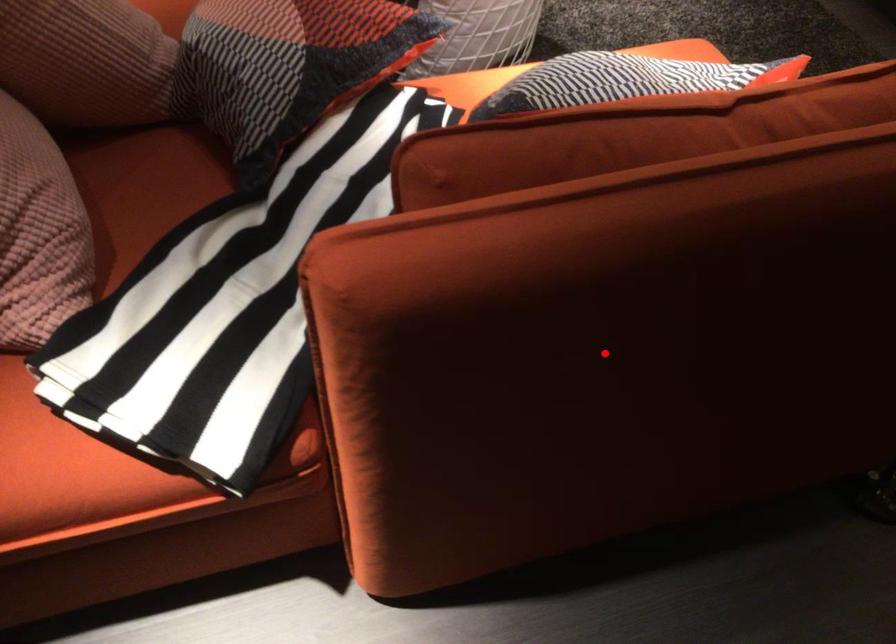
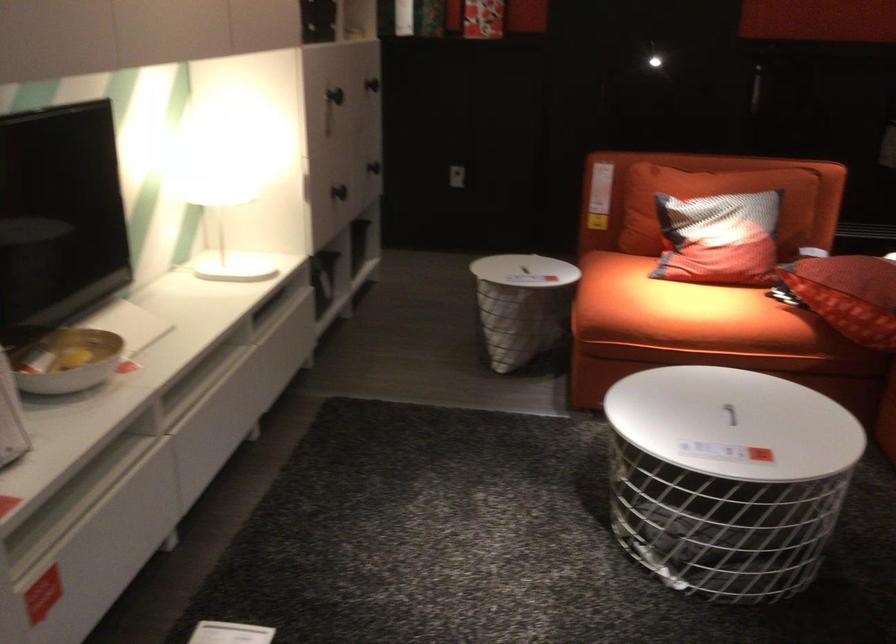
Question: I am providing you with two images of the same scene from different viewpoints. A red point is marked on the first image. Can you still see the location of the red point in image 2?

Choices:
 (A) Yes
 (B) No

Answer: (B)